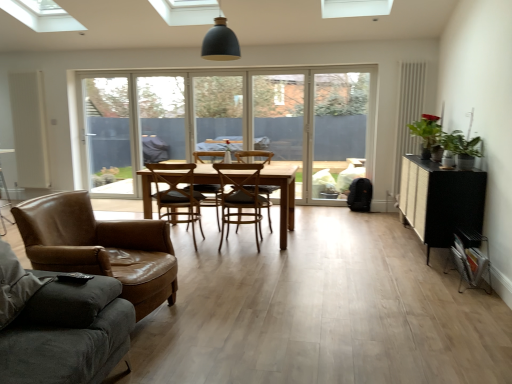
Question: From the image's perspective, is transparent glass door at left positioned above or below brown leather armchair at center?

Choices:
 (A) above
 (B) below

Answer: (A)

Question: From their relative heights in the image, would you say transparent glass door at left is taller or shorter than brown leather armchair at center?

Choices:
 (A) tall
 (B) short

Answer: (A)

Question: Estimate the real-world distances between objects in this image. Which object is closer to the dark gray fabric studio couch at lower left?

Choices:
 (A) white matte screen door at left, the second screen door in the right-to-left sequence
 (B) green glossy plant at right
 (C) transparent glass door at left
 (D) transparent glass door at center
 (E) transparent plastic screen door at center, which ranks as the first screen door in right-to-left order

Answer: (B)

Question: Based on their relative distances, which object is nearer to the white matte screen door at left, which appears as the first screen door when viewed from the left?

Choices:
 (A) wooden chair at center, which appears as the 2th chair when viewed from the front
 (B) transparent plastic screen door at center, positioned as the 2th screen door in left-to-right order
 (C) transparent glass door at center
 (D) transparent glass door at left
 (E) brown leather chair at center, arranged as the 3th chair when viewed from the front

Answer: (D)